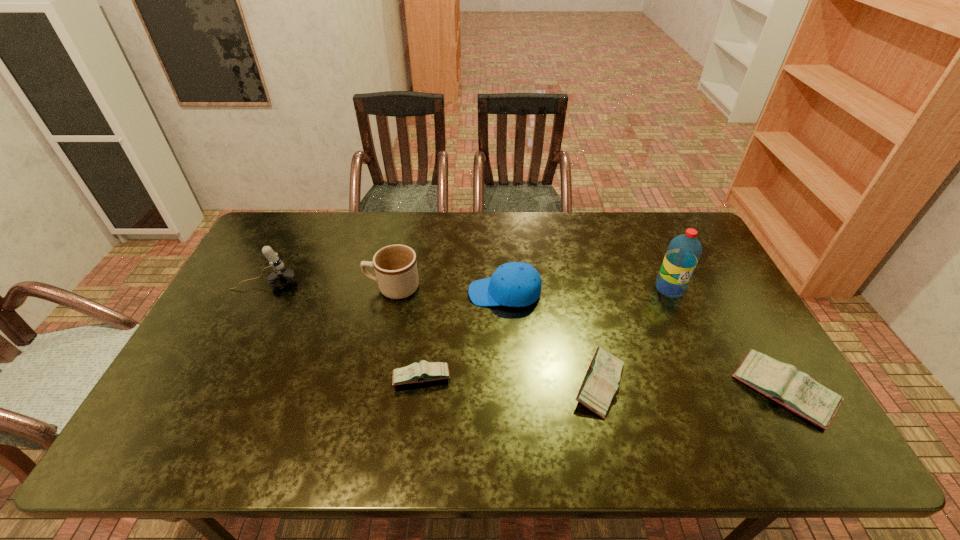
Where is `free space located 0.350m on the side of the third tallest object with the handle`? Image resolution: width=960 pixels, height=540 pixels. free space located 0.350m on the side of the third tallest object with the handle is located at coordinates (254, 288).

Locate an element on the screen. This screenshot has height=540, width=960. vacant space situated 0.280m on the side of the third tallest object with the handle is located at coordinates (276, 288).

At what (x,y) coordinates should I click in order to perform the action: click on free location located 0.230m on the side of the third tallest object with the handle. Please return your answer as a coordinate pair (x, y). This screenshot has width=960, height=540. Looking at the image, I should click on (293, 288).

This screenshot has width=960, height=540. What are the coordinates of `vacant space located 0.140m on the front of the leftmost object` in the screenshot? It's located at click(243, 328).

Identify the location of object that is at the left edge. (281, 277).

Where is `diary present at the right edge`? This screenshot has width=960, height=540. diary present at the right edge is located at coordinates (797, 391).

The height and width of the screenshot is (540, 960). I want to click on water bottle present at the right edge, so pos(683,253).

Locate an element on the screen. object located at the near right corner is located at coordinates tap(797, 391).

The width and height of the screenshot is (960, 540). In the image, there is a desktop. Find the location of `vacant space at the far edge`. vacant space at the far edge is located at coordinates (582, 216).

Identify the location of vacant space at the left edge. (229, 349).